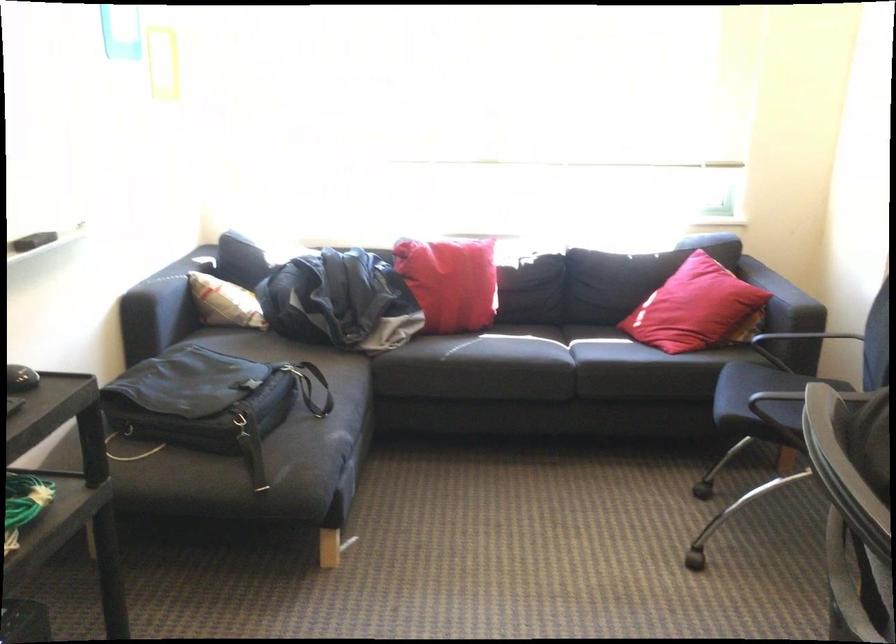
Find where to sit the dark sofa sitting surface. Please return your answer as a coordinate pair (x, y).

(535, 364)